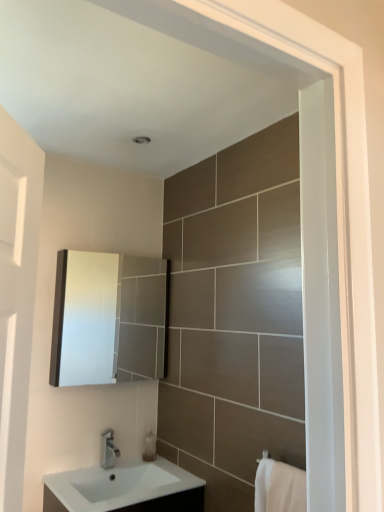
Question: Is white glossy sink at lower center, marked as the second sink in a top-to-bottom arrangement, at the right side of white glossy sink at lower center, which appears as the 2th sink when ordered from the bottom?

Choices:
 (A) no
 (B) yes

Answer: (A)

Question: Does white glossy sink at lower center, marked as the second sink in a top-to-bottom arrangement, have a greater height compared to white glossy sink at lower center, which appears as the 2th sink when ordered from the bottom?

Choices:
 (A) yes
 (B) no

Answer: (A)

Question: Does white glossy sink at lower center, marked as the second sink in a top-to-bottom arrangement, lie in front of white glossy sink at lower center, which appears as the 2th sink when ordered from the bottom?

Choices:
 (A) yes
 (B) no

Answer: (A)

Question: Is white glossy sink at lower center, the 1th sink from the bottom, wider than white glossy sink at lower center, which appears as the 2th sink when ordered from the bottom?

Choices:
 (A) yes
 (B) no

Answer: (A)

Question: Considering the relative sizes of white glossy sink at lower center, marked as the second sink in a top-to-bottom arrangement, and white glossy sink at lower center, arranged as the first sink when viewed from the top, in the image provided, is white glossy sink at lower center, marked as the second sink in a top-to-bottom arrangement, smaller than white glossy sink at lower center, arranged as the first sink when viewed from the top,?

Choices:
 (A) no
 (B) yes

Answer: (A)

Question: From a real-world perspective, is white glossy sink at lower center, the 1th sink from the bottom, on top of white glossy sink at lower center, which appears as the 2th sink when ordered from the bottom?

Choices:
 (A) no
 (B) yes

Answer: (A)

Question: Is white glossy sink at lower center, the 1th sink from the bottom, surrounded by white glossy sink at lower center, arranged as the first sink when viewed from the top?

Choices:
 (A) no
 (B) yes

Answer: (A)

Question: Does white glossy sink at lower center, arranged as the first sink when viewed from the top, have a greater height compared to white glossy sink at lower center, marked as the second sink in a top-to-bottom arrangement?

Choices:
 (A) yes
 (B) no

Answer: (B)

Question: From a real-world perspective, is white glossy sink at lower center, which appears as the 2th sink when ordered from the bottom, on top of white glossy sink at lower center, the 1th sink from the bottom?

Choices:
 (A) no
 (B) yes

Answer: (B)

Question: Is white glossy sink at lower center, arranged as the first sink when viewed from the top, thinner than white glossy sink at lower center, the 1th sink from the bottom?

Choices:
 (A) no
 (B) yes

Answer: (B)

Question: Can you confirm if white glossy sink at lower center, which appears as the 2th sink when ordered from the bottom, is positioned to the right of white glossy sink at lower center, the 1th sink from the bottom?

Choices:
 (A) no
 (B) yes

Answer: (B)

Question: Is white glossy sink at lower center, arranged as the first sink when viewed from the top, not inside white glossy sink at lower center, the 1th sink from the bottom?

Choices:
 (A) yes
 (B) no

Answer: (B)

Question: Is the position of translucent plastic soap dispenser at lower center more distant than that of silver metallic tap at lower center?

Choices:
 (A) no
 (B) yes

Answer: (B)